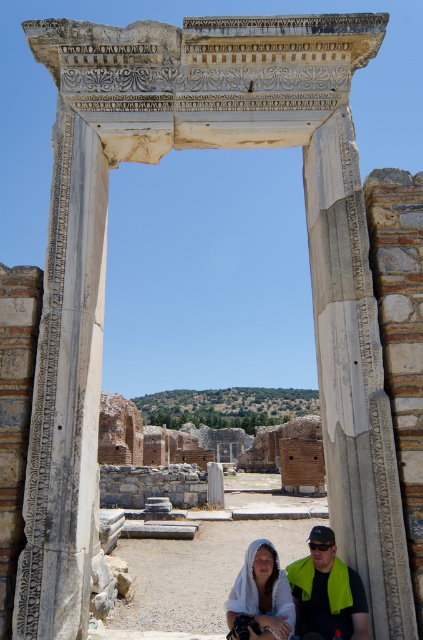
Question: Which point is closer to the camera taking this photo?

Choices:
 (A) (310, 547)
 (B) (263, 566)
 (C) (318, 564)

Answer: (C)

Question: Does white cloth at center have a larger size compared to black plastic goggles at lower center?

Choices:
 (A) yes
 (B) no

Answer: (A)

Question: Which point is closer to the camera?

Choices:
 (A) (313, 545)
 (B) (342, 637)
 (C) (238, 592)

Answer: (B)

Question: Can you confirm if white cloth at center is positioned below black plastic goggles at lower center?

Choices:
 (A) no
 (B) yes

Answer: (B)

Question: Can you confirm if white cloth at center is thinner than black plastic goggles at lower center?

Choices:
 (A) yes
 (B) no

Answer: (B)

Question: Which of the following is the farthest from the observer?

Choices:
 (A) black plastic goggles at lower center
 (B) green fabric towel at lower center
 (C) white cloth at center

Answer: (A)